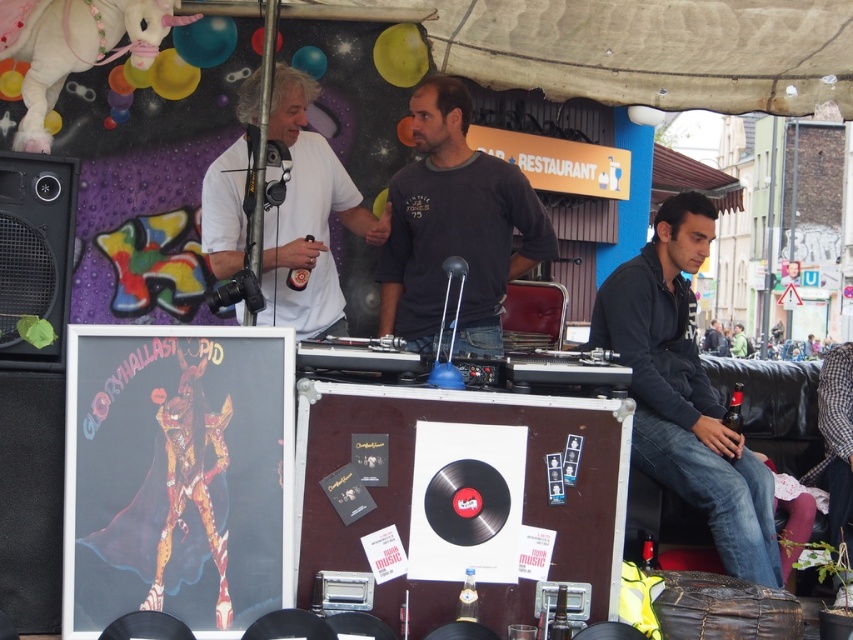
You are at the music event and want to take a photo of the black softshell jacket at lower right and the black matte speaker at left. Which object should you zoom in more on to ensure both are clearly visible in the frame?

You should zoom in more on the black softshell jacket at lower right because it is larger than the black matte speaker at left, so it will take up more space in the photo.

You are at the lively outdoor music event and want to find the DJ booth. There is a point marked at coordinates (456, 227). Which person at that point is most likely the DJ?

The dark gray long sleeved shirt at center is represented by point (456, 227), so the person at that point is the DJ.